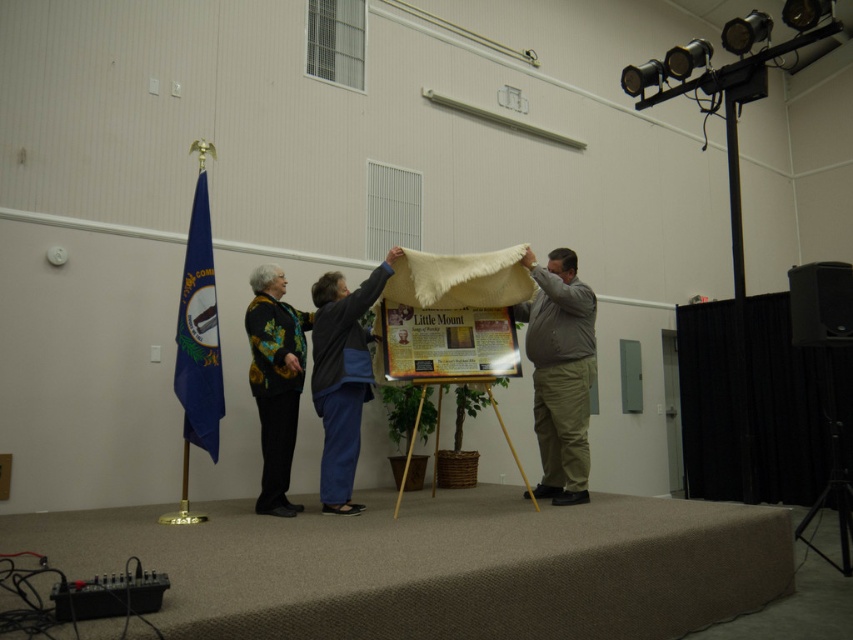
You are a GUI agent. You are given a task and a screenshot of the screen. Output one action in this format:
    pyautogui.click(x=<x>, y=<y>)
    Task: Click on the khaki cotton pants at center
    The height and width of the screenshot is (640, 853).
    Given the screenshot: What is the action you would take?
    pyautogui.click(x=560, y=372)

Is point (547, 305) positioned in front of point (421, 342)?

No.

Find the location of a particular element. Image resolution: width=853 pixels, height=640 pixels. khaki cotton pants at center is located at coordinates (560, 372).

Does matte paper bulletin board at center appear on the left side of black plastic speaker at right?

Correct, you'll find matte paper bulletin board at center to the left of black plastic speaker at right.

Identify the location of matte paper bulletin board at center. (444, 342).

Can you confirm if matte paper bulletin board at center is positioned to the left of blue fabric flag at left?

Incorrect, matte paper bulletin board at center is not on the left side of blue fabric flag at left.

Does matte paper bulletin board at center have a lesser width compared to blue fabric flag at left?

No, matte paper bulletin board at center is not thinner than blue fabric flag at left.

Is point (473, 372) positioned before point (198, 422)?

Yes, it is in front of point (198, 422).

At what (x,y) coordinates should I click in order to perform the action: click on matte paper bulletin board at center. Please return your answer as a coordinate pair (x, y). The width and height of the screenshot is (853, 640). Looking at the image, I should click on (444, 342).